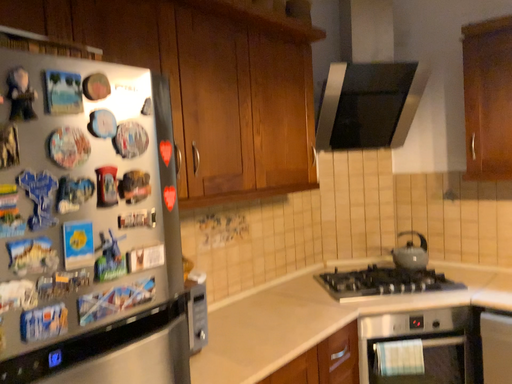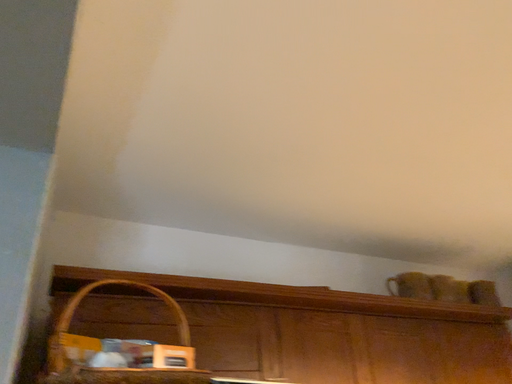
Question: How did the camera likely rotate when shooting the video?

Choices:
 (A) rotated right
 (B) rotated left

Answer: (B)